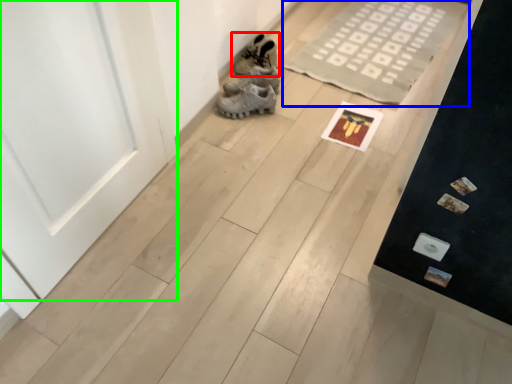
Question: Considering the real-world distances, which object is farthest from footwear (highlighted by a red box)? doormat (highlighted by a blue box) or door (highlighted by a green box)?

Choices:
 (A) doormat
 (B) door

Answer: (B)